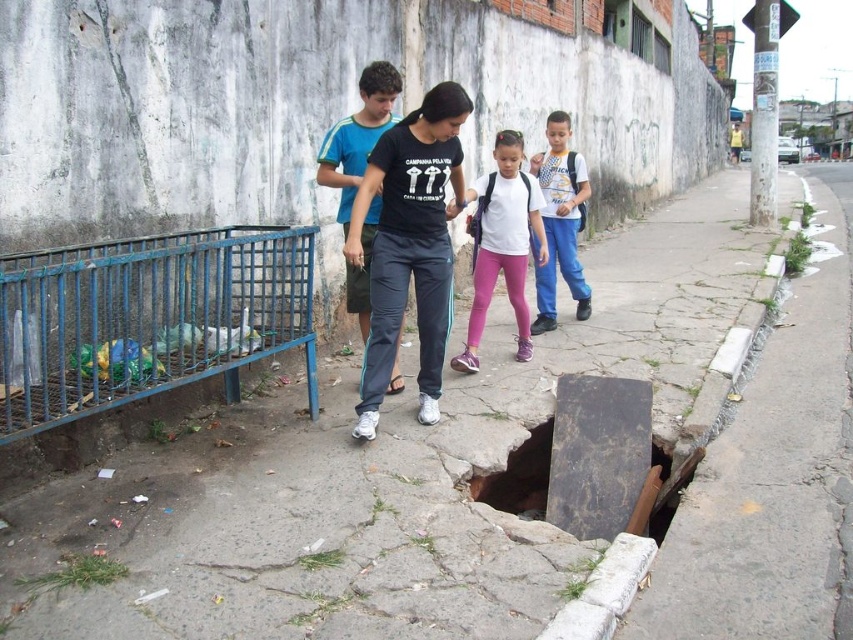
Who is positioned more to the right, cracked concrete pavement at center or blue jeans at center?

From the viewer's perspective, cracked concrete pavement at center appears more on the right side.

What do you see at coordinates (486, 474) in the screenshot?
I see `cracked concrete pavement at center` at bounding box center [486, 474].

Is point (399, 406) closer to camera compared to point (550, 132)?

Yes, it is.

The width and height of the screenshot is (853, 640). Identify the location of cracked concrete pavement at center. (486, 474).

Can you confirm if cracked concrete pavement at center is thinner than white matte shirt at center?

No.

Who is lower down, cracked concrete pavement at center or white matte shirt at center?

cracked concrete pavement at center is lower down.

Where is `cracked concrete pavement at center`? cracked concrete pavement at center is located at coordinates (486, 474).

Which of these two, cracked concrete pavement at center or dark blue track pants at center, stands taller?

Standing taller between the two is cracked concrete pavement at center.

Can you confirm if cracked concrete pavement at center is positioned to the left of dark blue track pants at center?

Incorrect, cracked concrete pavement at center is not on the left side of dark blue track pants at center.

Image resolution: width=853 pixels, height=640 pixels. I want to click on cracked concrete pavement at center, so click(486, 474).